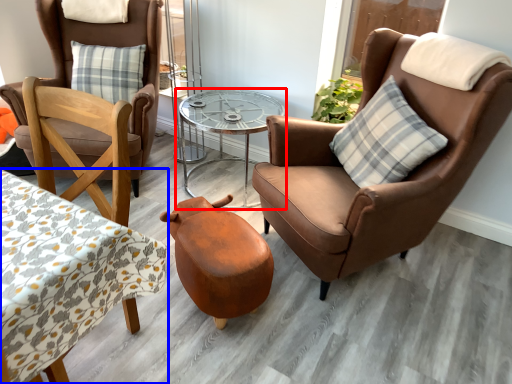
Question: Which of the following is the closest to the observer, table (highlighted by a red box) or coffee table (highlighted by a blue box)?

Choices:
 (A) table
 (B) coffee table

Answer: (B)